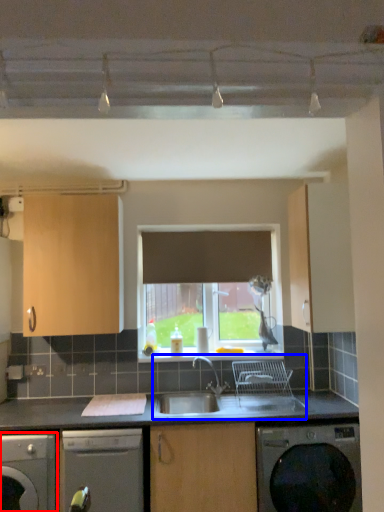
Question: Which point is further to the camera, dishwasher (highlighted by a red box) or sink (highlighted by a blue box)?

Choices:
 (A) dishwasher
 (B) sink

Answer: (B)